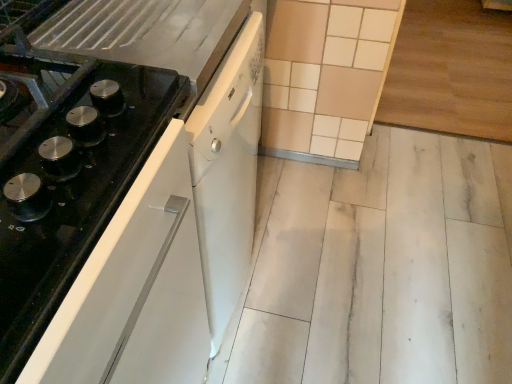
The height and width of the screenshot is (384, 512). Describe the element at coordinates (126, 187) in the screenshot. I see `black glass cooktop at upper left` at that location.

The width and height of the screenshot is (512, 384). I want to click on black glass cooktop at upper left, so click(126, 187).

Find the location of `black glass cooktop at upper left`. black glass cooktop at upper left is located at coordinates (126, 187).